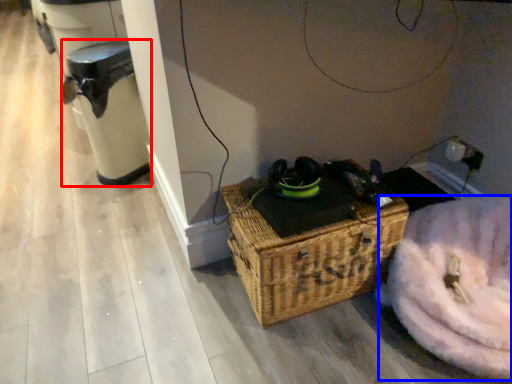
Question: Which object appears closest to the camera in this image, water heater (highlighted by a red box) or washer (highlighted by a blue box)?

Choices:
 (A) water heater
 (B) washer

Answer: (B)